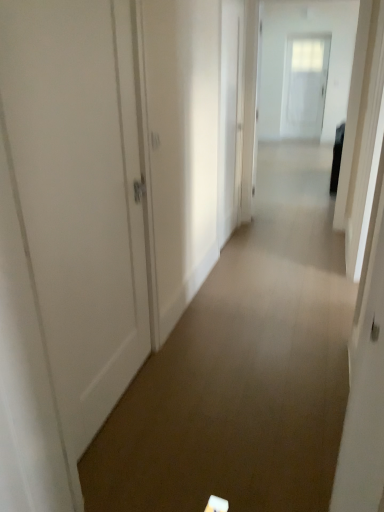
Question: From the image's perspective, would you say white glossy door at center, placed as the second door when sorted from back to front, is shown under white matte door at left, arranged as the 3th door when viewed from the back?

Choices:
 (A) yes
 (B) no

Answer: (B)

Question: Is white glossy door at center, placed as the second door when sorted from back to front, turned away from white matte door at left, which ranks as the 1th door in left-to-right order?

Choices:
 (A) no
 (B) yes

Answer: (A)

Question: Is white glossy door at center, which ranks as the 2th door in left-to-right order, at the right side of white matte door at left, which ranks as the 1th door in left-to-right order?

Choices:
 (A) yes
 (B) no

Answer: (A)

Question: Is white glossy door at center, the 2th door viewed from the front, located outside white matte door at left, arranged as the third door when viewed from the right?

Choices:
 (A) yes
 (B) no

Answer: (A)

Question: Does white glossy door at center, which ranks as the 2th door in left-to-right order, come behind white matte door at left, which appears as the first door when viewed from the front?

Choices:
 (A) no
 (B) yes

Answer: (B)

Question: Considering the relative sizes of white glossy door at center, which ranks as the 2th door in left-to-right order, and white matte door at left, which ranks as the first door in bottom-to-top order, in the image provided, is white glossy door at center, which ranks as the 2th door in left-to-right order, taller than white matte door at left, which ranks as the first door in bottom-to-top order,?

Choices:
 (A) yes
 (B) no

Answer: (A)

Question: Can you confirm if white glossy door at center, acting as the second door starting from the right, is shorter than white glossy door at upper center?

Choices:
 (A) yes
 (B) no

Answer: (A)

Question: Can you confirm if white glossy door at center, acting as the second door starting from the right, is positioned to the right of white glossy door at upper center?

Choices:
 (A) yes
 (B) no

Answer: (B)

Question: Does white glossy door at center, placed as the second door when sorted from back to front, come in front of white glossy door at upper center?

Choices:
 (A) yes
 (B) no

Answer: (A)

Question: Is white glossy door at center, acting as the second door starting from the right, not near white glossy door at upper center?

Choices:
 (A) yes
 (B) no

Answer: (A)

Question: Is the position of white glossy door at center, which ranks as the 2th door in left-to-right order, more distant than that of white glossy door at upper center?

Choices:
 (A) yes
 (B) no

Answer: (B)

Question: Considering the relative sizes of white glossy door at center, placed as the second door when sorted from back to front, and white glossy door at upper center in the image provided, is white glossy door at center, placed as the second door when sorted from back to front, bigger than white glossy door at upper center?

Choices:
 (A) yes
 (B) no

Answer: (B)

Question: Does white glossy door at upper center, placed as the 3th door when sorted from left to right, have a larger size compared to white glossy door at upper center?

Choices:
 (A) yes
 (B) no

Answer: (A)